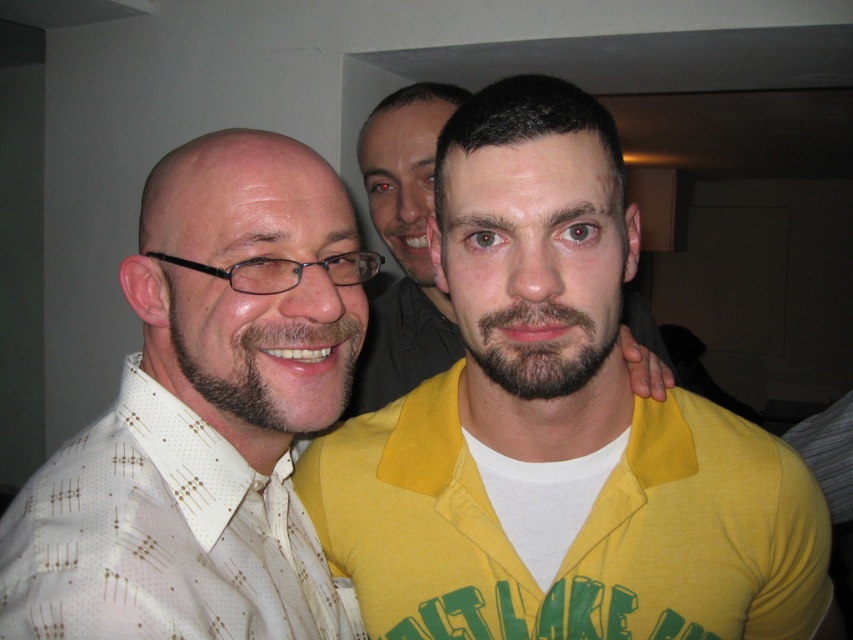
You are trying to decide which item is wider between the white dotted fabric shirt at left and the dark brown fuzzy beard at center. Based on the scene, which one has a greater width?

The white dotted fabric shirt at left has a greater width than the dark brown fuzzy beard at center.

You are trying to identify the person in the middle of the group. Which of the two items, the yellow matte shirt at center or the dark brown fuzzy beard at center, is located to the left of the other?

The yellow matte shirt at center is positioned on the right side of dark brown fuzzy beard at center, so the dark brown fuzzy beard at center is located to the left of the yellow matte shirt at center.

You are trying to decide which item to grab first from the center area. The yellow matte shirt at center and the dark brown fuzzy beard at center are both in your reach. Which one has a larger width?

The yellow matte shirt at center might be wider than dark brown fuzzy beard at center, so it is possible that the yellow matte shirt at center has a larger width.